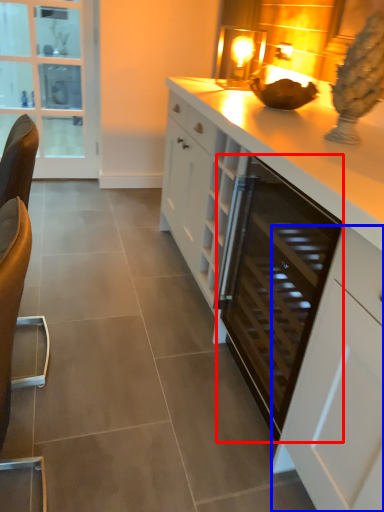
Question: Which object is closer to the camera taking this photo, appliance (highlighted by a red box) or cabinetry (highlighted by a blue box)?

Choices:
 (A) appliance
 (B) cabinetry

Answer: (B)